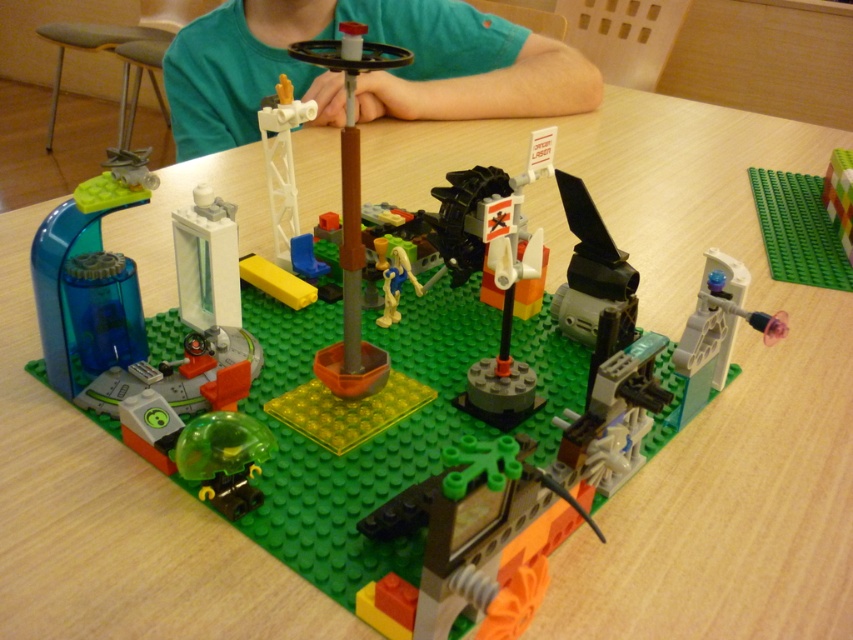
Question: Is green matte shirt at upper center to the left of yellow matte figure at center from the viewer's perspective?

Choices:
 (A) no
 (B) yes

Answer: (B)

Question: Does green matte shirt at upper center appear over yellow matte figure at center?

Choices:
 (A) yes
 (B) no

Answer: (A)

Question: From the image, what is the correct spatial relationship of green matte shirt at upper center in relation to yellow matte figure at center?

Choices:
 (A) above
 (B) below

Answer: (A)

Question: Among these points, which one is nearest to the camera?

Choices:
 (A) (195, 52)
 (B) (386, 291)

Answer: (B)

Question: Which object appears farthest from the camera in this image?

Choices:
 (A) green matte shirt at upper center
 (B) yellow matte figure at center

Answer: (A)

Question: Which point is farther to the camera?

Choices:
 (A) [381, 324]
 (B) [508, 49]

Answer: (B)